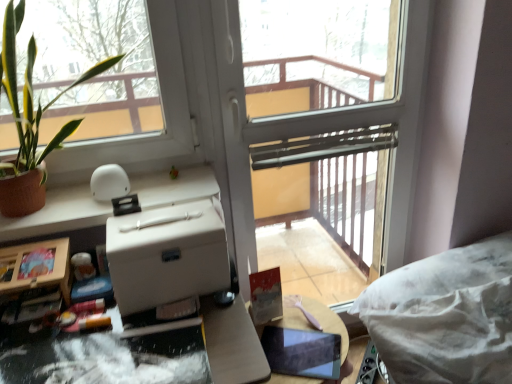
Question: Is wooden round table at center not inside transparent glass screen door at center?

Choices:
 (A) yes
 (B) no

Answer: (A)

Question: Is wooden round table at center to the right of transparent glass screen door at center from the viewer's perspective?

Choices:
 (A) no
 (B) yes

Answer: (A)

Question: Is wooden round table at center turned away from transparent glass screen door at center?

Choices:
 (A) yes
 (B) no

Answer: (A)

Question: Is wooden round table at center aimed at transparent glass screen door at center?

Choices:
 (A) yes
 (B) no

Answer: (B)

Question: From a real-world perspective, does wooden round table at center stand above transparent glass screen door at center?

Choices:
 (A) yes
 (B) no

Answer: (B)

Question: Considering the positions of white matte cardboard box at center and white matte counter top at upper left in the image, is white matte cardboard box at center taller or shorter than white matte counter top at upper left?

Choices:
 (A) short
 (B) tall

Answer: (B)

Question: Is white matte cardboard box at center to the left or to the right of white matte counter top at upper left in the image?

Choices:
 (A) left
 (B) right

Answer: (B)

Question: Relative to white matte counter top at upper left, is white matte cardboard box at center in front or behind?

Choices:
 (A) front
 (B) behind

Answer: (A)

Question: From the image's perspective, relative to white matte counter top at upper left, is white matte cardboard box at center above or below?

Choices:
 (A) below
 (B) above

Answer: (A)

Question: Choose the correct answer: Is transparent glass screen door at center inside white matte counter top at upper left or outside it?

Choices:
 (A) outside
 (B) inside

Answer: (A)

Question: In terms of height, does transparent glass screen door at center look taller or shorter compared to white matte counter top at upper left?

Choices:
 (A) short
 (B) tall

Answer: (B)

Question: In the image, is transparent glass screen door at center positioned in front of or behind white matte counter top at upper left?

Choices:
 (A) behind
 (B) front

Answer: (A)

Question: Considering the positions of transparent glass screen door at center and white matte counter top at upper left in the image, is transparent glass screen door at center bigger or smaller than white matte counter top at upper left?

Choices:
 (A) big
 (B) small

Answer: (A)

Question: In terms of height, does white matte counter top at upper left look taller or shorter compared to wooden round table at center?

Choices:
 (A) tall
 (B) short

Answer: (B)

Question: Is point (197, 180) closer or farther from the camera than point (292, 321)?

Choices:
 (A) farther
 (B) closer

Answer: (B)